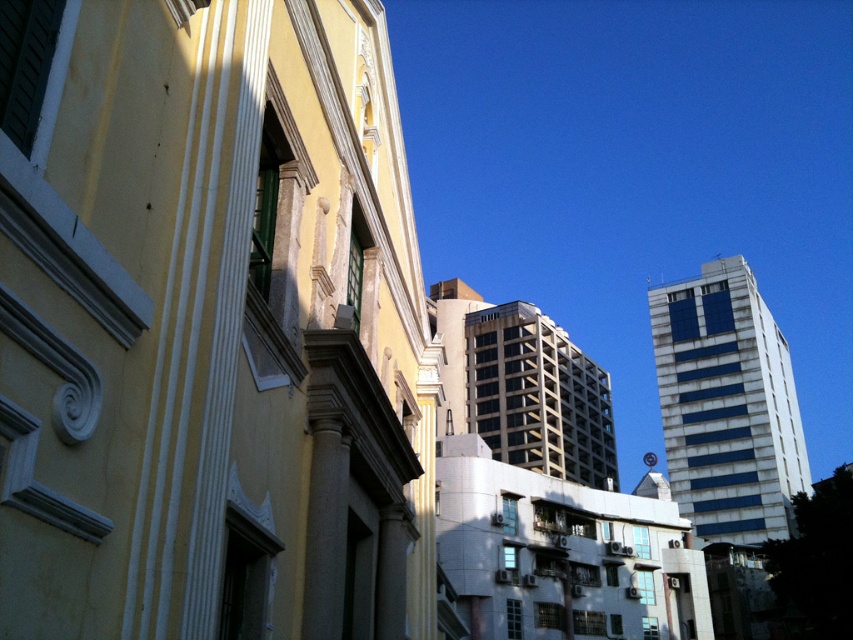
You are an architect planning to install a solar panel system on the roof of the blue glass building at upper right and the beige concrete building at center. Based on their positions, which building would require a longer cable run from the central power unit located at the center of the scene?

The blue glass building at upper right is positioned on the right side of the beige concrete building at center, so the blue glass building at upper right would require a longer cable run from the central power unit located at the center of the scene because it is farther away.

You are standing at the center of the classical building on the left. Looking towards the modern high rises on the right, where would you see the blue glass building at upper right in terms of your field of view?

The blue glass building at upper right is located at coordinates 0.634 on the x axis and 0.853 on the y axis, meaning it is positioned towards the upper right corner of your field of view.

You are an architect analyzing the urban layout. You notice the blue glass building at upper right and the beige concrete building at center. Which building appears closer to you in the image?

The blue glass building at upper right appears closer to you because it is positioned further to the viewer than the beige concrete building at center.